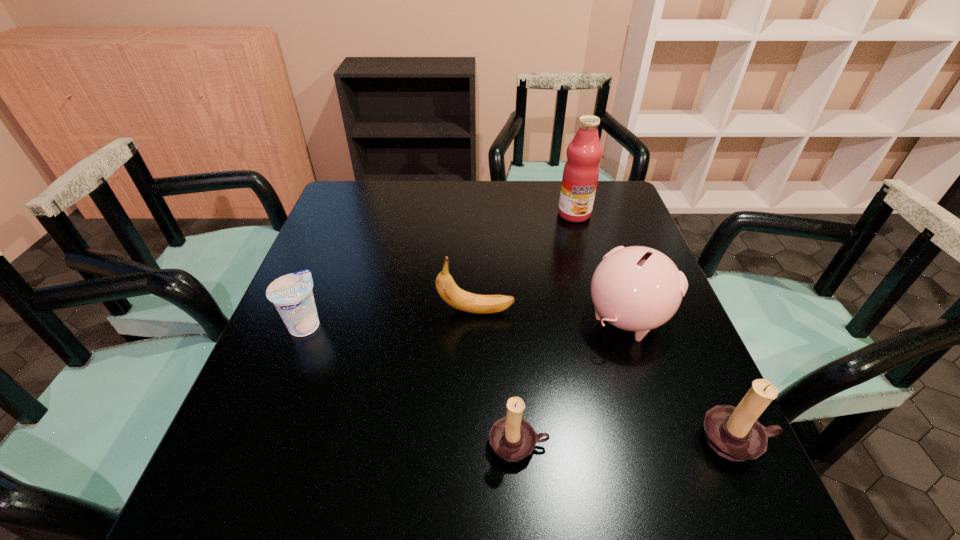
The image size is (960, 540). Identify the location of free space located on the front of the piggy bank. (661, 423).

Where is `vacant space located on the right of the shortest object`? Image resolution: width=960 pixels, height=540 pixels. vacant space located on the right of the shortest object is located at coordinates (391, 324).

Where is `object that is positioned at the far edge`? The height and width of the screenshot is (540, 960). object that is positioned at the far edge is located at coordinates pos(581,171).

The width and height of the screenshot is (960, 540). I want to click on object present at the left edge, so click(x=291, y=294).

Locate an element on the screen. Image resolution: width=960 pixels, height=540 pixels. candle holder at the right edge is located at coordinates (734, 433).

Find the location of a particular element. fruit juice positioned at the right edge is located at coordinates (581, 171).

Identify the location of piggy bank that is at the right edge. (636, 288).

At what (x,y) coordinates should I click in order to perform the action: click on object at the far right corner. Please return your answer as a coordinate pair (x, y). Looking at the image, I should click on (581, 171).

Where is `object that is at the near right corner`? Image resolution: width=960 pixels, height=540 pixels. object that is at the near right corner is located at coordinates (734, 433).

This screenshot has width=960, height=540. I want to click on free location at the far edge of the desktop, so click(x=510, y=185).